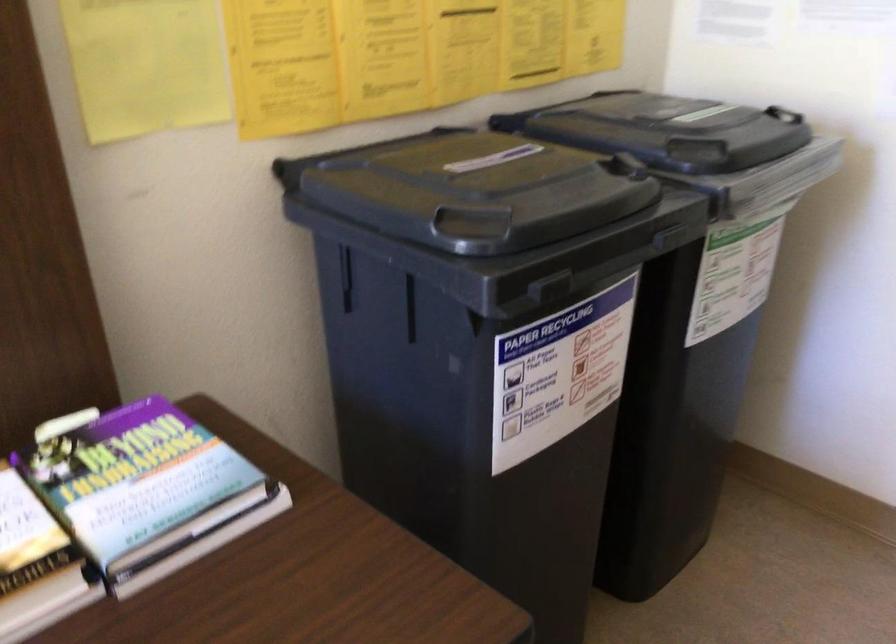
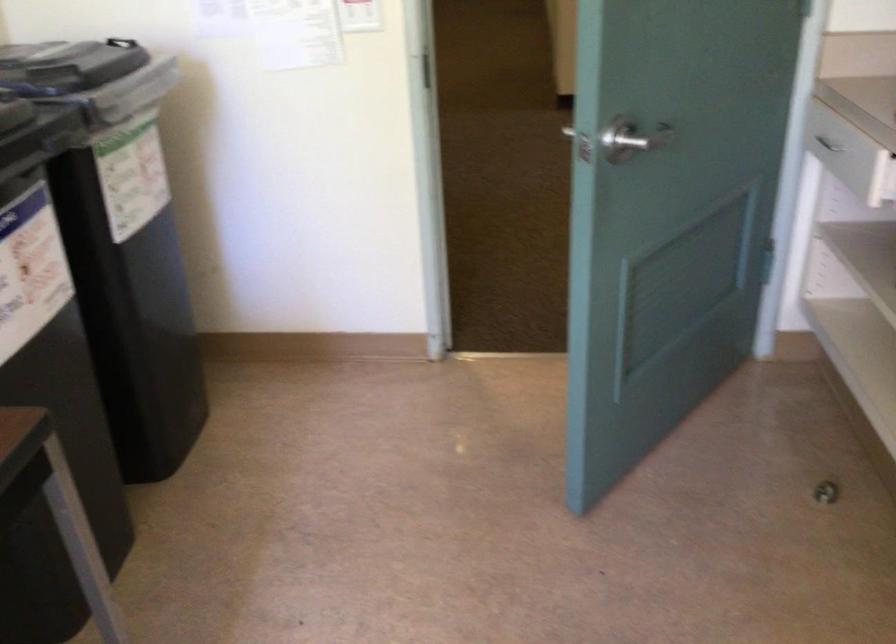
Where in the second image is the point corresponding to (634,234) from the first image?

(39, 135)